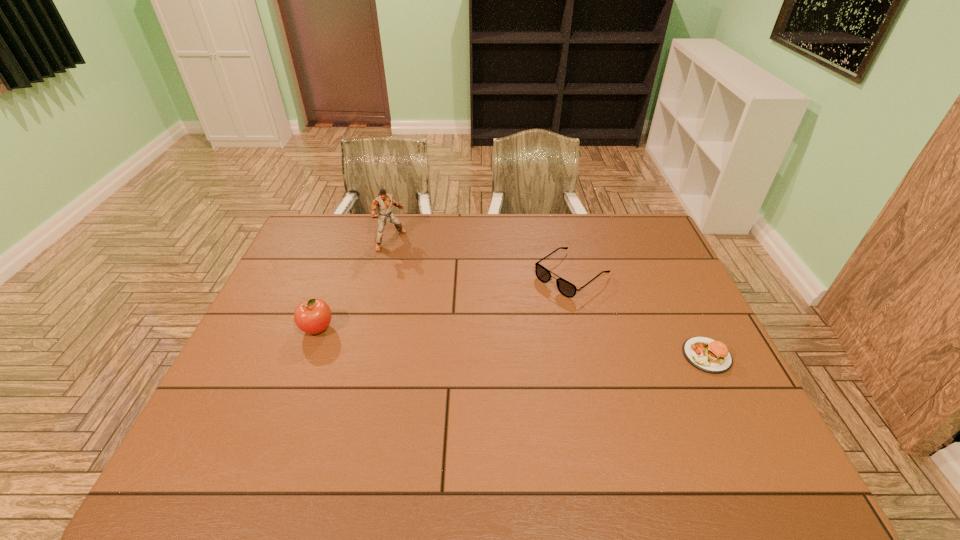
Identify the location of free space at the far edge. This screenshot has height=540, width=960. (470, 233).

Where is `vacant area at the near edge`? vacant area at the near edge is located at coordinates (271, 428).

Find the location of a particular element. This screenshot has height=540, width=960. vacant space at the left edge of the desktop is located at coordinates (306, 264).

Locate an element on the screen. This screenshot has width=960, height=540. vacant space at the right edge of the desktop is located at coordinates click(667, 354).

Locate an element on the screen. vacant region at the far left corner is located at coordinates (x=341, y=224).

This screenshot has height=540, width=960. Find the location of `vacant region at the near left corner of the desktop`. vacant region at the near left corner of the desktop is located at coordinates (x=234, y=418).

The image size is (960, 540). In the image, there is a desktop. Find the location of `vacant space at the far right corner`. vacant space at the far right corner is located at coordinates (614, 231).

I want to click on vacant region between the second object from left to right and the third shortest object, so click(354, 284).

The width and height of the screenshot is (960, 540). I want to click on free space between the third object from left to right and the apple, so click(x=444, y=301).

Locate an element on the screen. The height and width of the screenshot is (540, 960). free space between the rightmost object and the third shortest object is located at coordinates (512, 342).